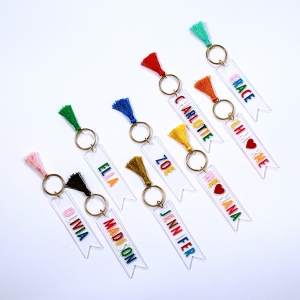
In order to click on red tassel in this screenshot , I will do `click(150, 61)`.